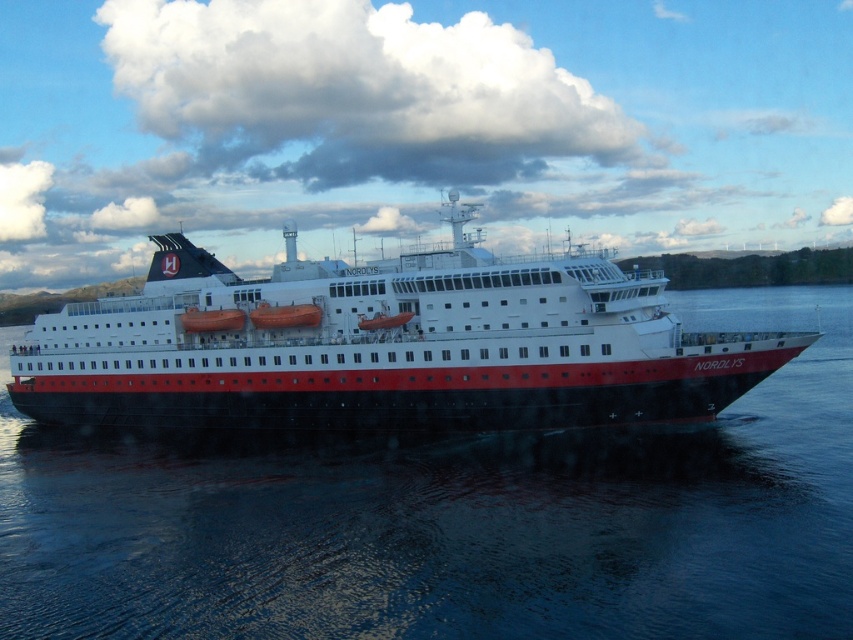
Based on the scene of the cruise ship Nordlys, which object is positioned to the right of the other between the black water at center and the polished steel ship at center?

The black water at center is positioned to the right of the polished steel ship at center.

You are standing on the deck of the cruise ship Nordlys and looking out towards the water. There is a point marked at coordinates (454,518). What color is the water at that point?

The water at point (454,518) is black.